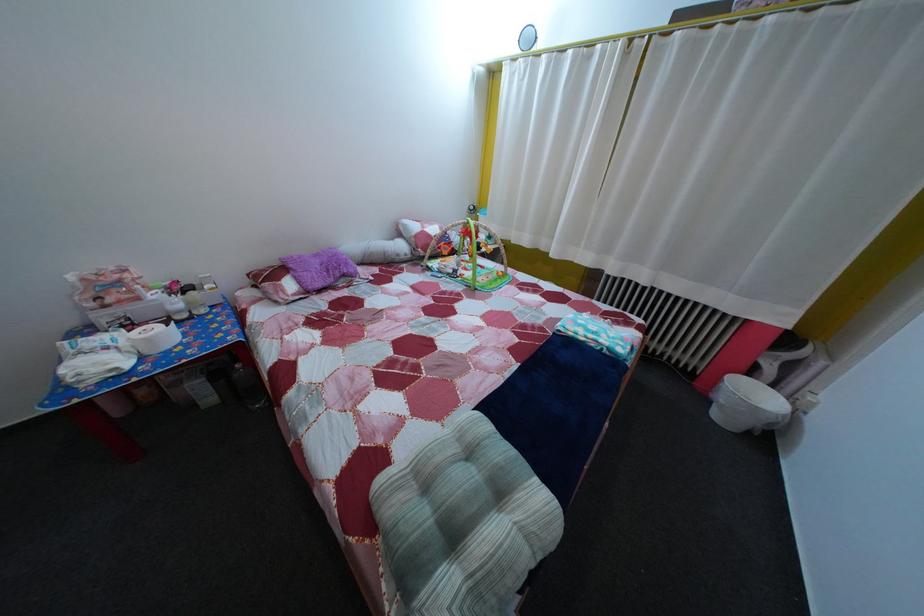
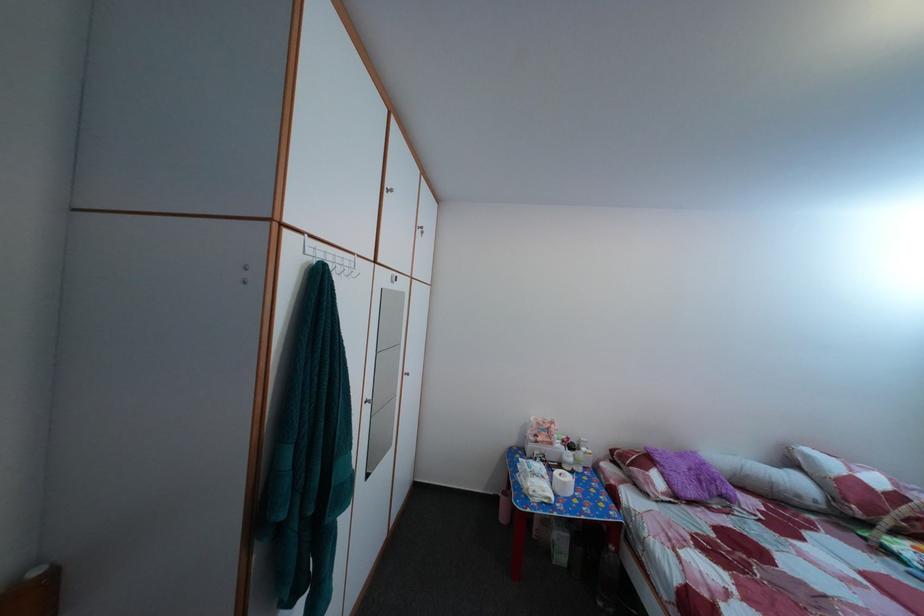
Where in the second image is the point corresponding to (x=407, y=262) from the first image?

(808, 504)